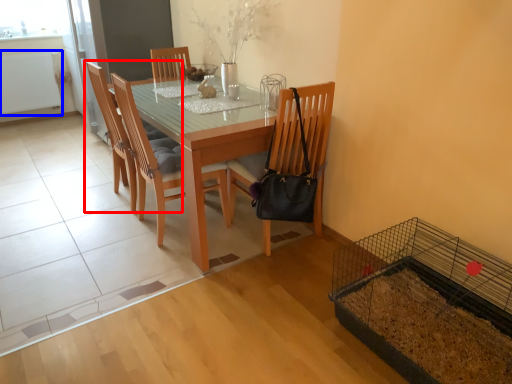
Question: Among these objects, which one is farthest to the camera, chair (highlighted by a red box) or radiator (highlighted by a blue box)?

Choices:
 (A) chair
 (B) radiator

Answer: (B)